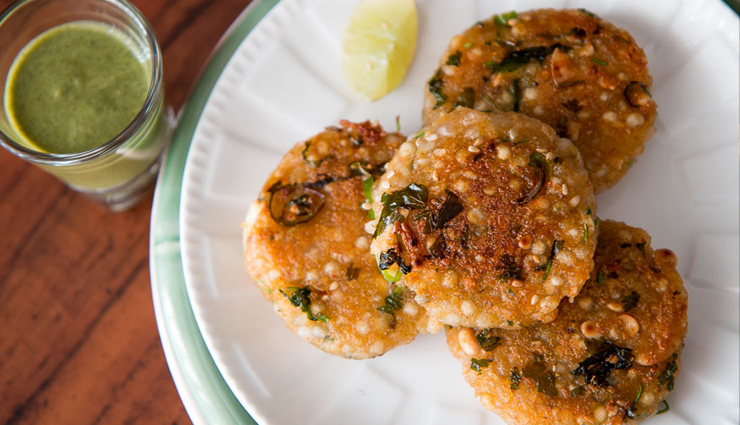
Where is `glass cup`? The width and height of the screenshot is (740, 425). glass cup is located at coordinates (456, 221), (292, 219), (534, 392), (556, 86), (95, 161), (69, 10).